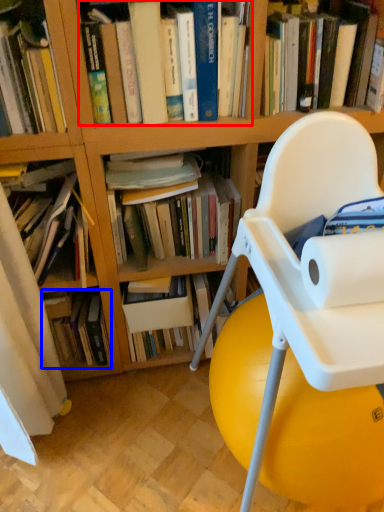
Question: Which point is closer to the camera, book (highlighted by a red box) or book (highlighted by a blue box)?

Choices:
 (A) book
 (B) book

Answer: (A)